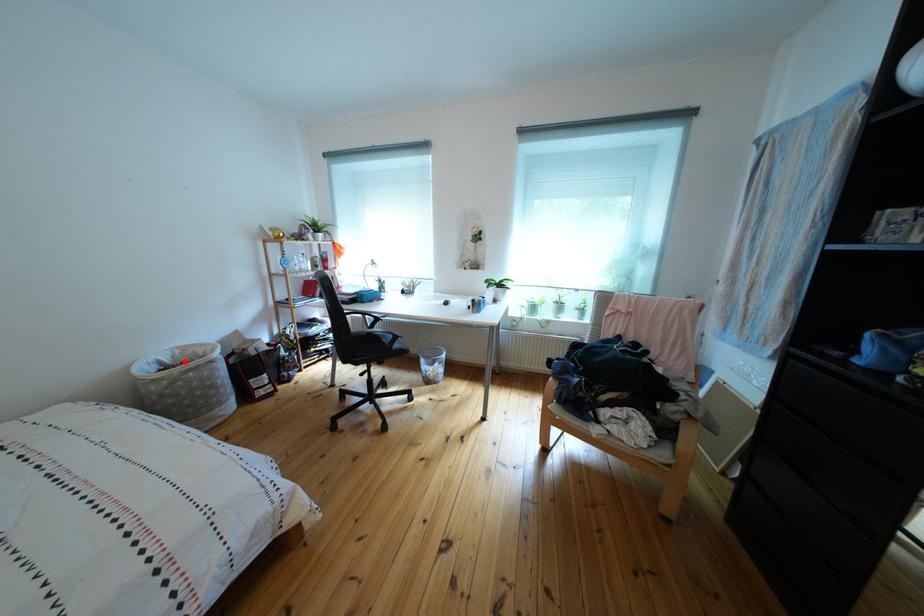
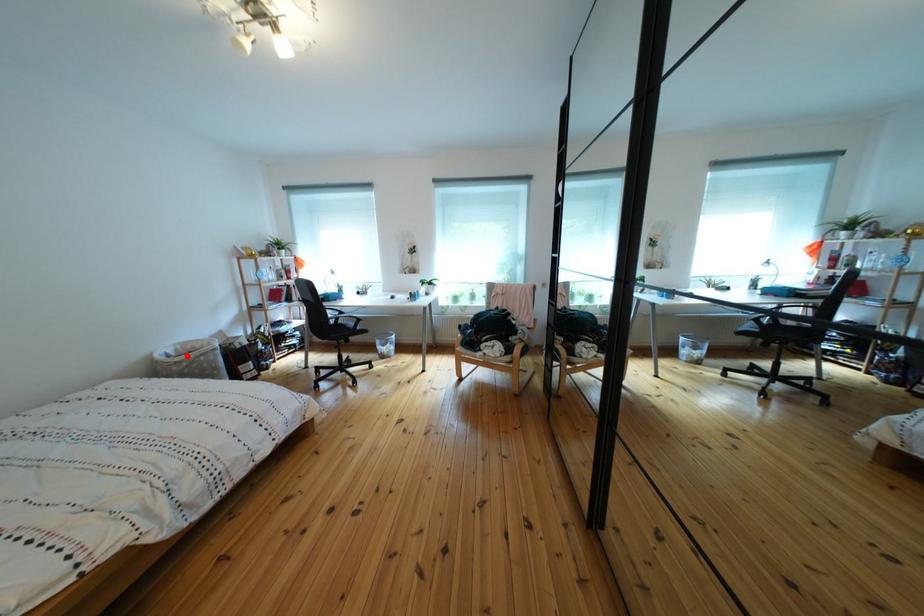
I am providing you with two images of the same scene from different viewpoints. A red point is marked on the first image and another point is marked on the second image. Is the marked point in image1 the same physical position as the marked point in image2?

Yes